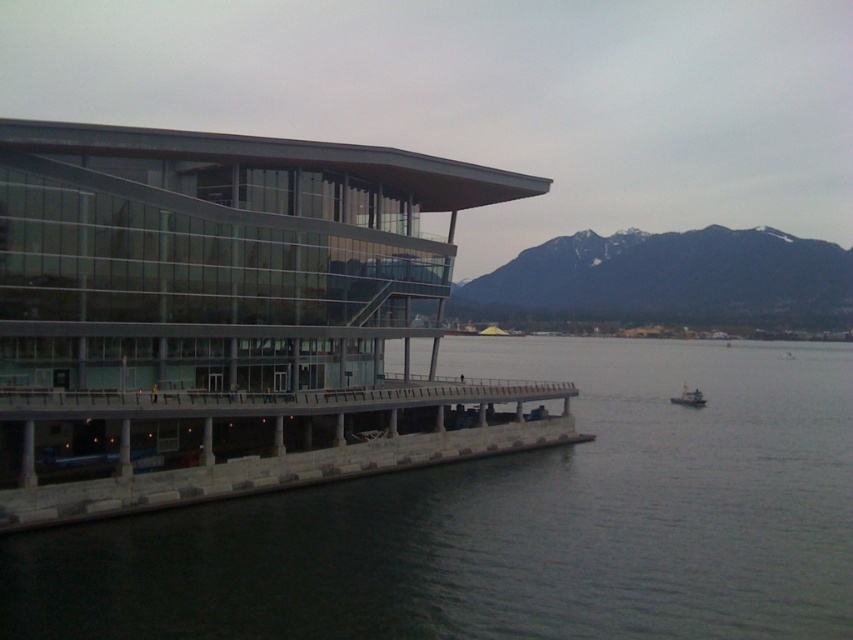
Does dark gray rocky mountain at upper center have a larger size compared to gray metallic boat at center-right?

Indeed, dark gray rocky mountain at upper center has a larger size compared to gray metallic boat at center-right.

Can you confirm if dark gray rocky mountain at upper center is positioned to the right of gray metallic boat at center-right?

Correct, you'll find dark gray rocky mountain at upper center to the right of gray metallic boat at center-right.

Is point (802, 252) closer to viewer compared to point (679, 401)?

No, it is behind (679, 401).

This screenshot has width=853, height=640. I want to click on dark gray rocky mountain at upper center, so click(x=666, y=276).

Between concrete dock at lower left and gray metallic boat at center-right, which one has more height?

concrete dock at lower left

Does concrete dock at lower left have a greater height compared to gray metallic boat at center-right?

Correct, concrete dock at lower left is much taller as gray metallic boat at center-right.

This screenshot has width=853, height=640. In order to click on concrete dock at lower left in this screenshot , I will do `click(293, 456)`.

At what (x,y) coordinates should I click in order to perform the action: click on concrete dock at lower left. Please return your answer as a coordinate pair (x, y). Image resolution: width=853 pixels, height=640 pixels. Looking at the image, I should click on (293, 456).

Is dark gray rocky mountain at upper center positioned behind concrete dock at lower left?

That is True.

Is point (612, 250) positioned before point (119, 452)?

No, it is behind (119, 452).

At what (x,y) coordinates should I click in order to perform the action: click on dark gray rocky mountain at upper center. Please return your answer as a coordinate pair (x, y). Looking at the image, I should click on (666, 276).